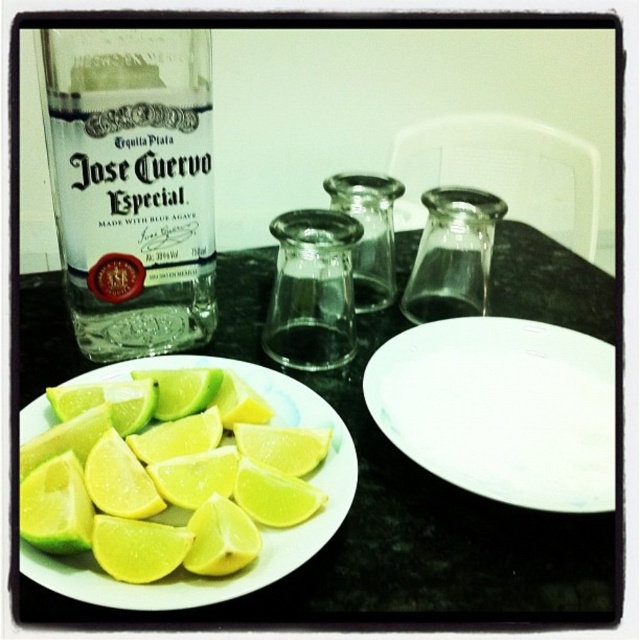
You are setting up a dinner table and need to place a decorative item between the green matte plate at lower left and the yellow matte lemon at lower left. Which object should you place the item closer to if you want it to be closer to the left edge of the table?

The yellow matte lemon at lower left is on the left side of the green matte plate at lower left. Therefore, placing the decorative item closer to the yellow matte lemon at lower left will position it nearer to the left edge of the table.

You are setting up a dinner table and have placed a green matte plate at lower left and a yellow matte lemon at lower left. Which object is taller?

The green matte plate at lower left is taller than the yellow matte lemon at lower left.

You are standing at the edge of the table and want to reach both points on the table. Which point, point (346, 524) or point (252, 481), is closer to you?

Point (346, 524) is closer to you because it is further to the viewer than point (252, 481).